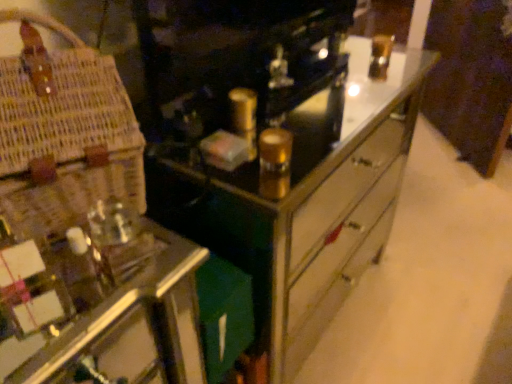
Image resolution: width=512 pixels, height=384 pixels. I want to click on vacant area that is situated to the right of metallic mirrored chest of drawers at center, so click(x=432, y=284).